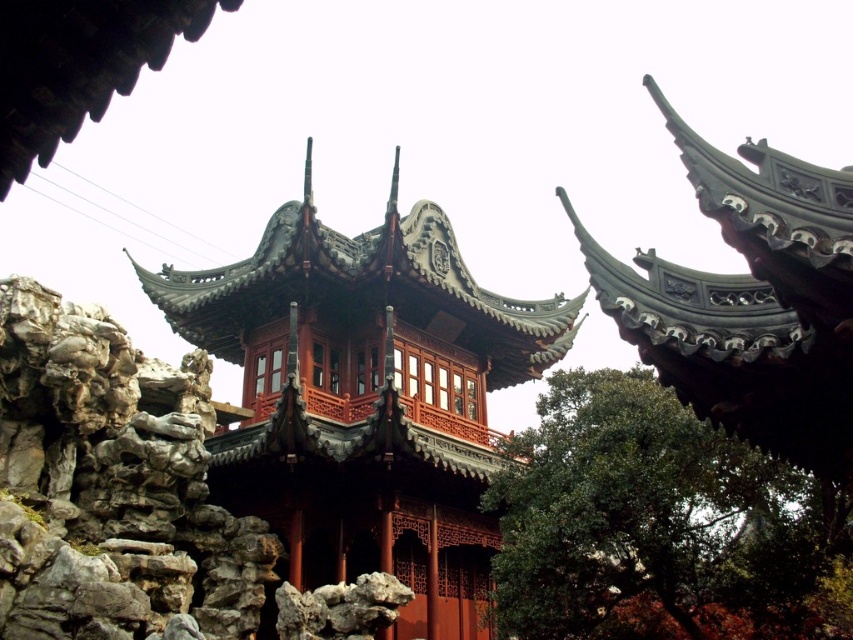
You are standing in front of the traditional Chinese building and want to take a photo. You notice two points marked on the structure. One is at point coordinates point [119,378] and the other is at point coordinates point [556,499]. Which point is closer to your camera when taking the photo?

Point [119,378] is further to the camera than point [556,499], so the point closer to the camera is point [556,499].

You are standing in the garden and want to locate the matte red wooden pavilion at center. According to the coordinates provided, where would you find it?

The matte red wooden pavilion at center is located at coordinates point (366, 397).